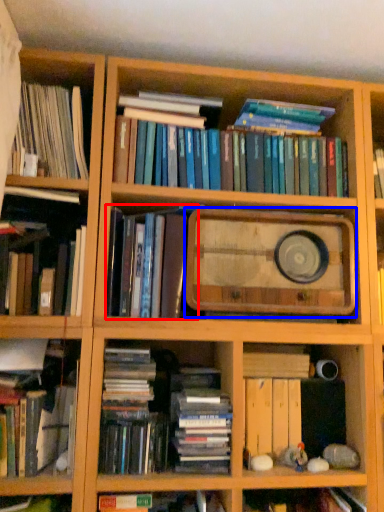
Question: Which object appears closest to the camera in this image, book (highlighted by a red box) or paperback book (highlighted by a blue box)?

Choices:
 (A) book
 (B) paperback book

Answer: (A)